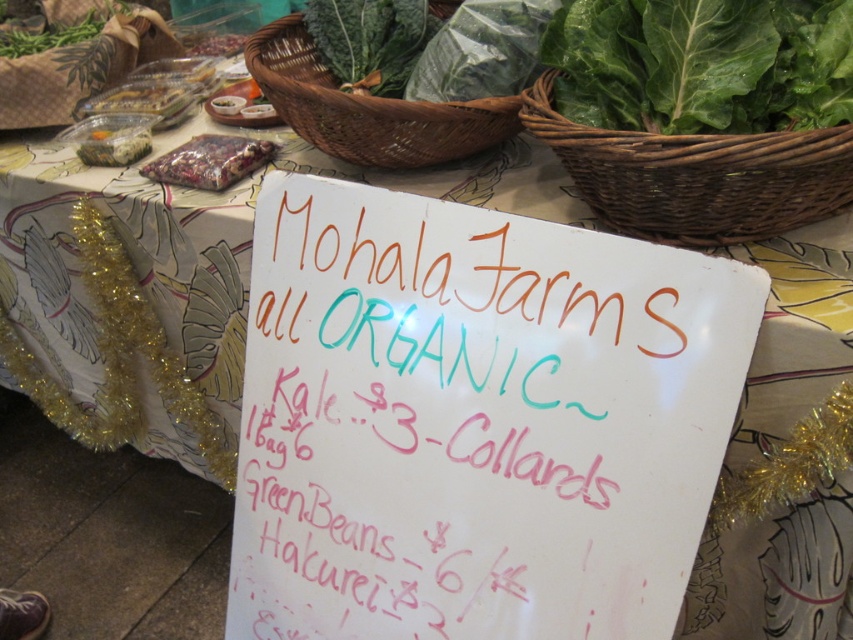
Question: Which of these objects is positioned farthest from the green leafy at center?

Choices:
 (A) translucent plastic container at upper left
 (B) white paper sign at center
 (C) woven brown basket at upper right

Answer: (A)

Question: Considering the real-world distances, which object is closest to the woven brown basket at upper right?

Choices:
 (A) green leafy at upper right
 (B) translucent plastic bag at upper left

Answer: (A)

Question: In this image, where is white paper sign at center located relative to translucent plastic container at upper left?

Choices:
 (A) left
 (B) right

Answer: (B)

Question: Which point is closer to the camera?

Choices:
 (A) [x=38, y=35]
 (B) [x=135, y=134]
 (C) [x=468, y=108]

Answer: (C)

Question: Observing the image, what is the correct spatial positioning of woven brown basket at upper right in reference to translucent plastic bag at upper left?

Choices:
 (A) right
 (B) left

Answer: (A)

Question: Can you confirm if translucent plastic bag at upper left is thinner than green leafy at upper left?

Choices:
 (A) yes
 (B) no

Answer: (A)